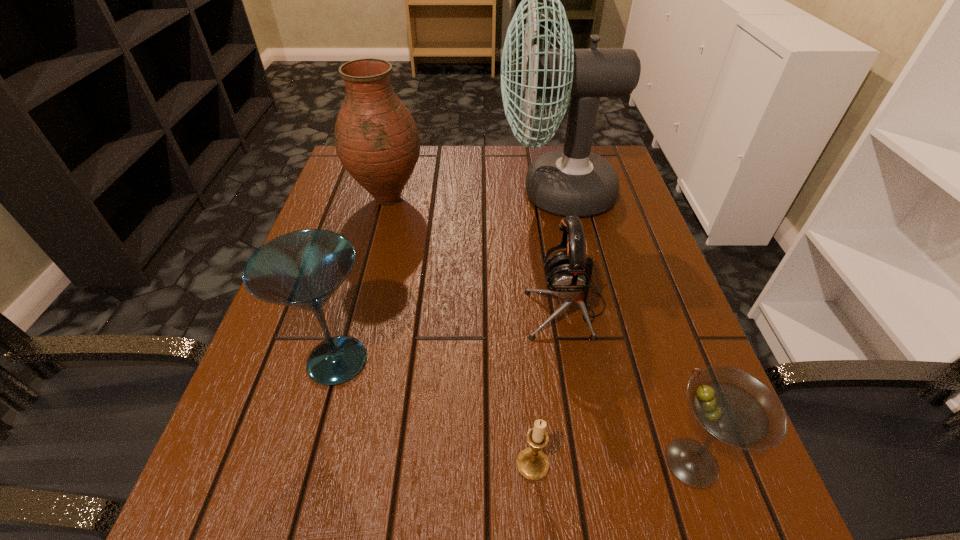
This screenshot has width=960, height=540. I want to click on vacant space in between the vase and the shortest object, so click(460, 332).

This screenshot has width=960, height=540. I want to click on vacant area that lies between the earphone and the fan, so click(561, 250).

I want to click on object that stands as the third closest to the earphone, so click(532, 463).

You are a GUI agent. You are given a task and a screenshot of the screen. Output one action in this format:
    pyautogui.click(x=<x>, y=<y>)
    Task: Click on the object that can be found as the third closest to the earphone
    The height and width of the screenshot is (540, 960).
    Given the screenshot: What is the action you would take?
    pyautogui.click(x=532, y=463)

This screenshot has height=540, width=960. In order to click on free space that satisfies the following two spatial constraints: 1. on the back side of the nearer martini; 2. in front of the tallest object where the airflow is directed in this screenshot , I will do `click(601, 193)`.

You are a GUI agent. You are given a task and a screenshot of the screen. Output one action in this format:
    pyautogui.click(x=<x>, y=<y>)
    Task: Click on the free region that satisfies the following two spatial constraints: 1. in front of the nearer martini where the airflow is directed; 2. on the left side of the tallest object
    Image resolution: width=960 pixels, height=540 pixels.
    Given the screenshot: What is the action you would take?
    pyautogui.click(x=613, y=462)

Identify the location of free space that satisfies the following two spatial constraints: 1. on the back side of the earphone; 2. on the right side of the shortest object. (519, 307).

This screenshot has width=960, height=540. I want to click on vacant space that satisfies the following two spatial constraints: 1. on the back side of the farther martini; 2. on the left side of the earphone, so click(352, 307).